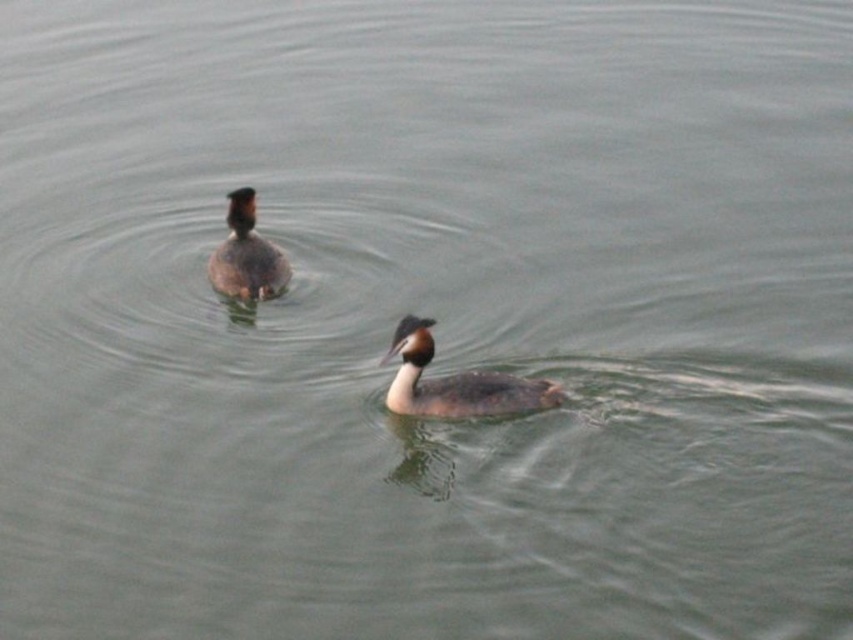
Between brown matte duck at center and brown speckled duck at upper center, which one appears on the left side from the viewer's perspective?

brown speckled duck at upper center is more to the left.

Does brown matte duck at center appear on the left side of brown speckled duck at upper center?

No, brown matte duck at center is not to the left of brown speckled duck at upper center.

Does point (408, 358) come closer to viewer compared to point (259, 259)?

That is True.

Locate an element on the screen. The height and width of the screenshot is (640, 853). brown matte duck at center is located at coordinates (456, 381).